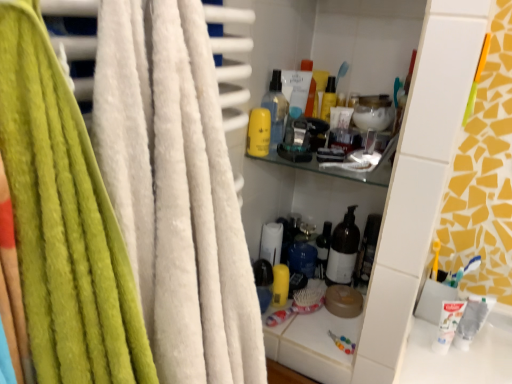
Question: Does point (254, 112) appear closer or farther from the camera than point (368, 253)?

Choices:
 (A) closer
 (B) farther

Answer: (A)

Question: Would you say yellow matte lotion at upper center is to the left or to the right of translucent glass bottle at center, marked as the first bottle in a back-to-front arrangement, in the picture?

Choices:
 (A) left
 (B) right

Answer: (A)

Question: Which of these objects is positioned farthest from the yellow matte lotion at upper center?

Choices:
 (A) translucent plastic spray bottle at upper center, which is the second bottle from back to front
 (B) white matte toothpaste at lower right
 (C) blue plastic toothbrush at lower right
 (D) translucent glass bottle at center, the 1th bottle ordered from the bottom

Answer: (B)

Question: Which of these objects is positioned farthest from the white matte toothpaste at lower right?

Choices:
 (A) blue plastic toothbrush at lower right
 (B) yellow matte lotion at upper center
 (C) translucent plastic spray bottle at upper center, the 1th bottle positioned from the top
 (D) translucent glass bottle at center, the second bottle from the left

Answer: (C)